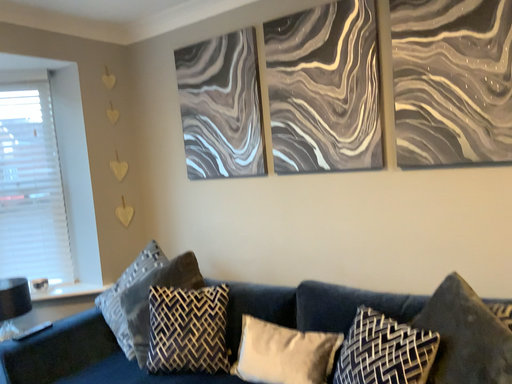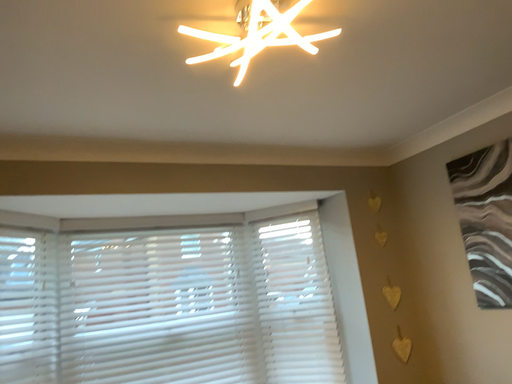
Question: Which way did the camera rotate in the video?

Choices:
 (A) rotated upward
 (B) rotated downward

Answer: (A)